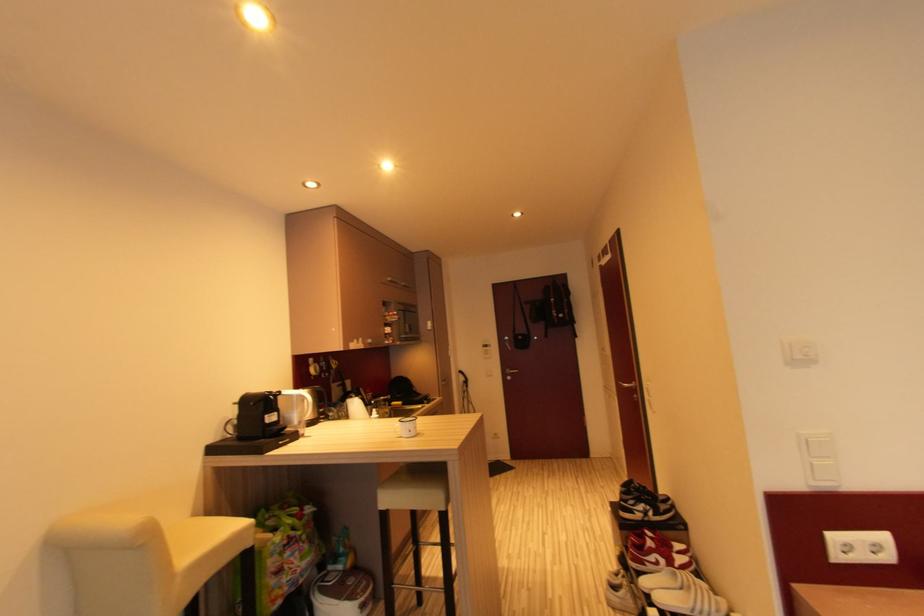
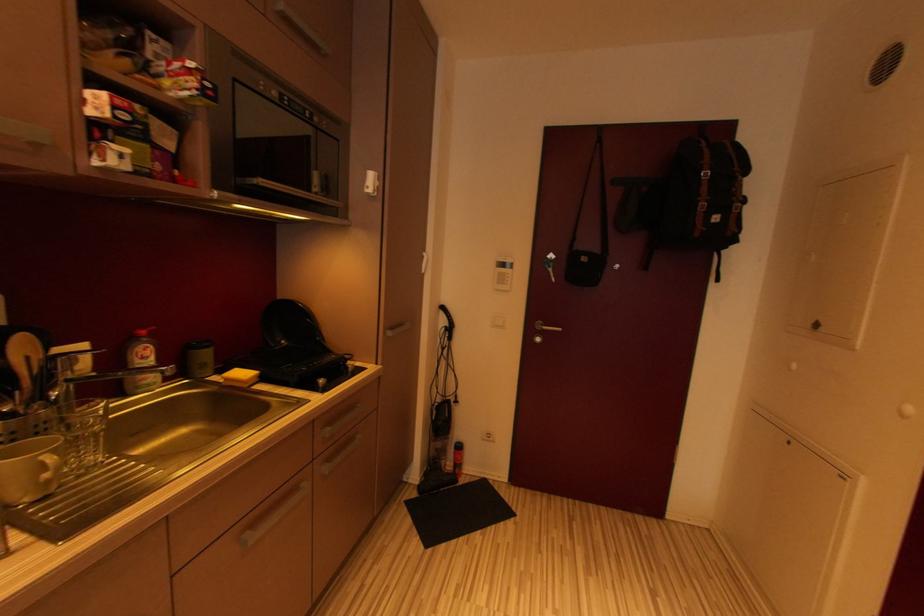
Question: The images are taken continuously from a first-person perspective. In which direction are you moving?

Choices:
 (A) Left
 (B) Right
 (C) Forward
 (D) Backward

Answer: (C)